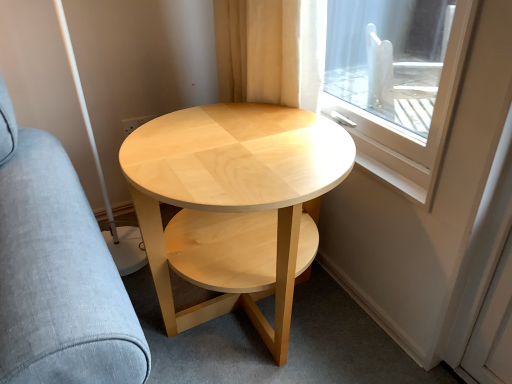
Question: Choose the correct answer: Is light gray fabric swivel chair at left inside natural wood coffee table at center or outside it?

Choices:
 (A) inside
 (B) outside

Answer: (B)

Question: Is light gray fabric swivel chair at left wider or thinner than natural wood coffee table at center?

Choices:
 (A) wide
 (B) thin

Answer: (A)

Question: From their relative heights in the image, would you say light gray fabric swivel chair at left is taller or shorter than natural wood coffee table at center?

Choices:
 (A) short
 (B) tall

Answer: (B)

Question: In terms of height, does natural wood coffee table at center look taller or shorter compared to light gray fabric swivel chair at left?

Choices:
 (A) tall
 (B) short

Answer: (B)

Question: Do you think natural wood coffee table at center is within light gray fabric swivel chair at left, or outside of it?

Choices:
 (A) inside
 (B) outside

Answer: (B)

Question: In terms of width, does natural wood coffee table at center look wider or thinner when compared to light gray fabric swivel chair at left?

Choices:
 (A) wide
 (B) thin

Answer: (B)

Question: In the image, is natural wood coffee table at center positioned in front of or behind light gray fabric swivel chair at left?

Choices:
 (A) behind
 (B) front

Answer: (A)